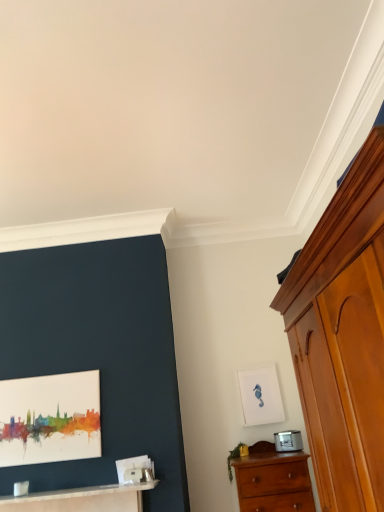
The width and height of the screenshot is (384, 512). What do you see at coordinates (260, 396) in the screenshot? I see `white matte picture frame at upper right, the 2th picture frame from the front` at bounding box center [260, 396].

What is the approximate height of white glossy table at lower left?

1.12 inches.

Locate an element on the screen. Image resolution: width=384 pixels, height=512 pixels. watercolor paper painting at left, placed as the 1th picture frame when sorted from front to back is located at coordinates (50, 418).

Who is shorter, watercolor paper painting at left, which is the 1th picture frame in left-to-right order, or wooden chest of drawers at right, positioned as the 1th chest of drawers in top-to-bottom order?

watercolor paper painting at left, which is the 1th picture frame in left-to-right order, is shorter.

Is watercolor paper painting at left, arranged as the second picture frame when viewed from the back, smaller than wooden chest of drawers at right, the first chest of drawers positioned from the front?

Correct, watercolor paper painting at left, arranged as the second picture frame when viewed from the back, occupies less space than wooden chest of drawers at right, the first chest of drawers positioned from the front.

From the picture: Relative to wooden chest of drawers at right, the first chest of drawers positioned from the front, is watercolor paper painting at left, the 2th picture frame when ordered from right to left, in front or behind?

Visually, watercolor paper painting at left, the 2th picture frame when ordered from right to left, is located behind wooden chest of drawers at right, the first chest of drawers positioned from the front.

Which object is wider, watercolor paper painting at left, placed as the 1th picture frame when sorted from front to back, or wooden chest of drawers at right, placed as the 2th chest of drawers when sorted from bottom to top?

Wider between the two is wooden chest of drawers at right, placed as the 2th chest of drawers when sorted from bottom to top.

Are wooden chest of drawers at lower right, positioned as the first chest of drawers in bottom-to-top order, and white matte picture frame at upper right, which ranks as the second picture frame in left-to-right order, beside each other?

wooden chest of drawers at lower right, positioned as the first chest of drawers in bottom-to-top order, is not next to white matte picture frame at upper right, which ranks as the second picture frame in left-to-right order, and they're not touching.

From the picture: Who is bigger, wooden chest of drawers at lower right, positioned as the first chest of drawers in bottom-to-top order, or white matte picture frame at upper right, the 2th picture frame from the front?

Bigger between the two is wooden chest of drawers at lower right, positioned as the first chest of drawers in bottom-to-top order.

Image resolution: width=384 pixels, height=512 pixels. I want to click on the chest of drawers below the white matte picture frame at upper right, which is the 1th picture frame in right-to-left order (from the image's perspective), so click(273, 480).

From a real-world perspective, who is located lower, wooden chest of drawers at lower right, the 2th chest of drawers in the top-to-bottom sequence, or white glossy table at lower left?

wooden chest of drawers at lower right, the 2th chest of drawers in the top-to-bottom sequence, is physically lower.

Is point (275, 502) less distant than point (110, 488)?

Yes, it is in front of point (110, 488).

Considering the relative positions of watercolor paper painting at left, the 2th picture frame when ordered from right to left, and white matte picture frame at upper right, the 2th picture frame from the front, in the image provided, is watercolor paper painting at left, the 2th picture frame when ordered from right to left, behind white matte picture frame at upper right, the 2th picture frame from the front,?

No, watercolor paper painting at left, the 2th picture frame when ordered from right to left, is closer to the viewer.

From a real-world perspective, is watercolor paper painting at left, placed as the 1th picture frame when sorted from front to back, above or below white matte picture frame at upper right, which is the 1th picture frame in right-to-left order?

From a real-world perspective, watercolor paper painting at left, placed as the 1th picture frame when sorted from front to back, is physically above white matte picture frame at upper right, which is the 1th picture frame in right-to-left order.

Which of these two, watercolor paper painting at left, the 2th picture frame when ordered from right to left, or white matte picture frame at upper right, which is the 1th picture frame in right-to-left order, stands taller?

With more height is watercolor paper painting at left, the 2th picture frame when ordered from right to left.

From a real-world perspective, relative to wooden chest of drawers at lower right, positioned as the first chest of drawers in bottom-to-top order, is watercolor paper painting at left, placed as the 1th picture frame when sorted from front to back, vertically above or below?

From a real-world perspective, watercolor paper painting at left, placed as the 1th picture frame when sorted from front to back, is physically above wooden chest of drawers at lower right, positioned as the first chest of drawers in bottom-to-top order.

Considering the positions of objects watercolor paper painting at left, which is the 1th picture frame in left-to-right order, and wooden chest of drawers at lower right, positioned as the first chest of drawers in bottom-to-top order, in the image provided, who is more to the right, watercolor paper painting at left, which is the 1th picture frame in left-to-right order, or wooden chest of drawers at lower right, positioned as the first chest of drawers in bottom-to-top order,?

wooden chest of drawers at lower right, positioned as the first chest of drawers in bottom-to-top order, is more to the right.

Is point (42, 460) farther from viewer compared to point (302, 453)?

Yes.

From the image's perspective, which one is positioned higher, white glossy table at lower left or white matte picture frame at upper right, which is the 1th picture frame in right-to-left order?

white matte picture frame at upper right, which is the 1th picture frame in right-to-left order, is shown above in the image.

Would you say white glossy table at lower left is a long distance from white matte picture frame at upper right, which is the 1th picture frame in right-to-left order?

white glossy table at lower left is far away from white matte picture frame at upper right, which is the 1th picture frame in right-to-left order.

Can you confirm if white glossy table at lower left is positioned to the right of white matte picture frame at upper right, which is the 1th picture frame in right-to-left order?

No, white glossy table at lower left is not to the right of white matte picture frame at upper right, which is the 1th picture frame in right-to-left order.

Is white glossy table at lower left wider or thinner than white matte picture frame at upper right, which is counted as the first picture frame, starting from the back?

Clearly, white glossy table at lower left has more width compared to white matte picture frame at upper right, which is counted as the first picture frame, starting from the back.

In the image, there is a white matte picture frame at upper right, which ranks as the second picture frame in left-to-right order. Identify the location of the chest of drawers above it (from the image's perspective). (333, 331).

Which of these two, wooden chest of drawers at right, placed as the 2th chest of drawers when sorted from bottom to top, or white matte picture frame at upper right, which is counted as the first picture frame, starting from the back, is bigger?

wooden chest of drawers at right, placed as the 2th chest of drawers when sorted from bottom to top, is bigger.

Based on the photo, is wooden chest of drawers at right, positioned as the 1th chest of drawers in top-to-bottom order, next to white matte picture frame at upper right, which ranks as the second picture frame in left-to-right order, and touching it?

wooden chest of drawers at right, positioned as the 1th chest of drawers in top-to-bottom order, and white matte picture frame at upper right, which ranks as the second picture frame in left-to-right order, are clearly separated.

There is a watercolor paper painting at left, placed as the 1th picture frame when sorted from front to back. Find the location of `the 1st chest of drawers below it (from a real-world perspective)`. the 1st chest of drawers below it (from a real-world perspective) is located at coordinates (333, 331).

Which picture frame is the 2nd one when counting from the back of the wooden chest of drawers at lower right, marked as the 2th chest of drawers in a front-to-back arrangement? Please provide its 2D coordinates.

[(260, 396)]

In the scene shown: Estimate the real-world distances between objects in this image. Which object is closer to wooden chest of drawers at right, the first chest of drawers positioned from the front, white matte picture frame at upper right, which is the 1th picture frame in right-to-left order, or watercolor paper painting at left, which is the 1th picture frame in left-to-right order?

white matte picture frame at upper right, which is the 1th picture frame in right-to-left order, is closer to wooden chest of drawers at right, the first chest of drawers positioned from the front.

Looking at this image, based on their spatial positions, is wooden chest of drawers at lower right, which ranks as the 1th chest of drawers in back-to-front order, or white matte picture frame at upper right, the 2th picture frame from the front, closer to watercolor paper painting at left, arranged as the second picture frame when viewed from the back?

Based on the image, wooden chest of drawers at lower right, which ranks as the 1th chest of drawers in back-to-front order, appears to be nearer to watercolor paper painting at left, arranged as the second picture frame when viewed from the back.

From the picture: Based on their spatial positions, is wooden chest of drawers at right, the first chest of drawers positioned from the front, or white glossy table at lower left closer to white matte picture frame at upper right, which is the 1th picture frame in right-to-left order?

white glossy table at lower left is closer to white matte picture frame at upper right, which is the 1th picture frame in right-to-left order.

Considering their positions, is watercolor paper painting at left, which is the 1th picture frame in left-to-right order, positioned further to wooden chest of drawers at lower right, positioned as the first chest of drawers in bottom-to-top order, than white glossy table at lower left?

watercolor paper painting at left, which is the 1th picture frame in left-to-right order, lies further to wooden chest of drawers at lower right, positioned as the first chest of drawers in bottom-to-top order, than the other object.

Which object lies further to the anchor point watercolor paper painting at left, which is the 1th picture frame in left-to-right order, white glossy table at lower left or wooden chest of drawers at lower right, positioned as the first chest of drawers in bottom-to-top order?

The object further to watercolor paper painting at left, which is the 1th picture frame in left-to-right order, is wooden chest of drawers at lower right, positioned as the first chest of drawers in bottom-to-top order.

Estimate the real-world distances between objects in this image. Which object is further from watercolor paper painting at left, the 2th picture frame when ordered from right to left, white glossy table at lower left or wooden chest of drawers at right, the second chest of drawers when ordered from back to front?

The object further to watercolor paper painting at left, the 2th picture frame when ordered from right to left, is wooden chest of drawers at right, the second chest of drawers when ordered from back to front.

Based on their spatial positions, is white matte picture frame at upper right, which is the 1th picture frame in right-to-left order, or wooden chest of drawers at right, placed as the 2th chest of drawers when sorted from bottom to top, closer to white glossy table at lower left?

Based on the image, white matte picture frame at upper right, which is the 1th picture frame in right-to-left order, appears to be nearer to white glossy table at lower left.

Considering their positions, is watercolor paper painting at left, which is the 1th picture frame in left-to-right order, positioned further to wooden chest of drawers at right, the first chest of drawers positioned from the front, than wooden chest of drawers at lower right, which ranks as the 1th chest of drawers in back-to-front order?

The object further to wooden chest of drawers at right, the first chest of drawers positioned from the front, is watercolor paper painting at left, which is the 1th picture frame in left-to-right order.

Image resolution: width=384 pixels, height=512 pixels. I want to click on picture frame located between white glossy table at lower left and wooden chest of drawers at lower right, the 2th chest of drawers in the top-to-bottom sequence, in the left-right direction, so click(x=260, y=396).

You are a GUI agent. You are given a task and a screenshot of the screen. Output one action in this format:
    pyautogui.click(x=<x>, y=<y>)
    Task: Click on the table positioned between wooden chest of drawers at right, positioned as the 1th chest of drawers in top-to-bottom order, and watercolor paper painting at left, which is the 1th picture frame in left-to-right order, from near to far
    The width and height of the screenshot is (384, 512).
    Given the screenshot: What is the action you would take?
    pyautogui.click(x=82, y=499)

You are a GUI agent. You are given a task and a screenshot of the screen. Output one action in this format:
    pyautogui.click(x=<x>, y=<y>)
    Task: Click on the chest of drawers located between wooden chest of drawers at right, the first chest of drawers positioned from the front, and white matte picture frame at upper right, the 2th picture frame from the front, in the depth direction
    This screenshot has width=384, height=512.
    Given the screenshot: What is the action you would take?
    pyautogui.click(x=273, y=480)

Where is `picture frame positioned between wooden chest of drawers at right, placed as the 2th chest of drawers when sorted from bottom to top, and white matte picture frame at upper right, which is the 1th picture frame in right-to-left order, from near to far`? Image resolution: width=384 pixels, height=512 pixels. picture frame positioned between wooden chest of drawers at right, placed as the 2th chest of drawers when sorted from bottom to top, and white matte picture frame at upper right, which is the 1th picture frame in right-to-left order, from near to far is located at coordinates (50, 418).